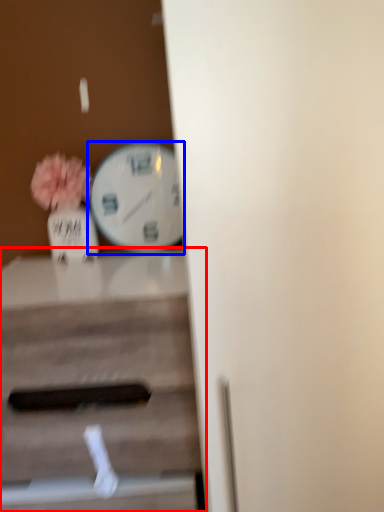
Question: Among these objects, which one is farthest to the camera, table (highlighted by a red box) or wall clock (highlighted by a blue box)?

Choices:
 (A) table
 (B) wall clock

Answer: (B)